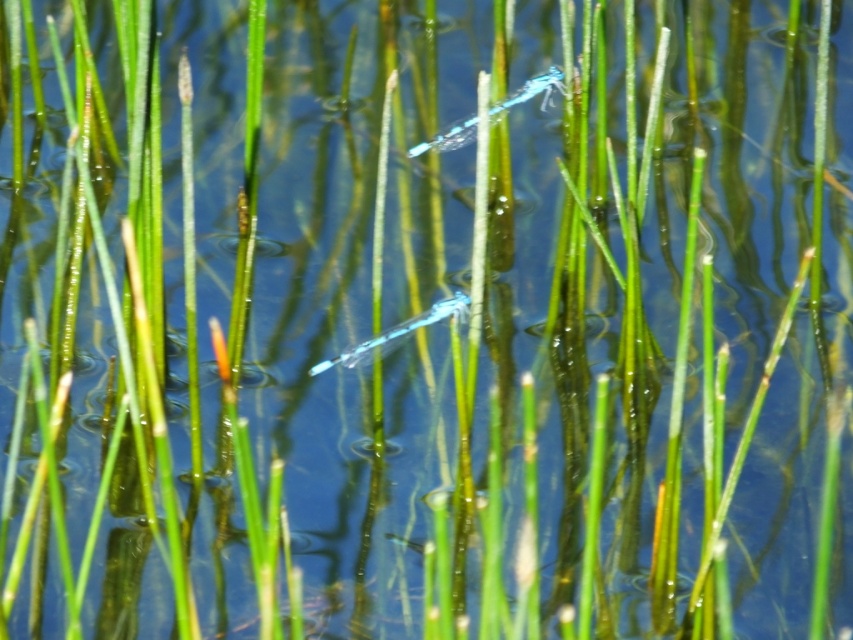
You are an ornithologist observing the serene aquatic scene. You notice two dragonflies, the transparent blue dragonfly at upper center and the translucent blue dragonfly at center. Which dragonfly is positioned higher in the image?

The transparent blue dragonfly at upper center is positioned higher in the image than the translucent blue dragonfly at center.

You are standing 5 feet away from the transparent blue dragonfly at upper center. Can you reach it with a 6 foot long fishing rod?

The transparent blue dragonfly at upper center is 5.15 feet away from the viewer. Since the fishing rod is 6 feet long, you can reach it with the rod.

You are an entomologist observing the two dragonflies in the scene. Which dragonfly has a larger wingspan? The transparent blue dragonfly at upper center or the translucent blue dragonfly at center?

The transparent blue dragonfly at upper center might be wider than the translucent blue dragonfly at center, so it likely has a larger wingspan.